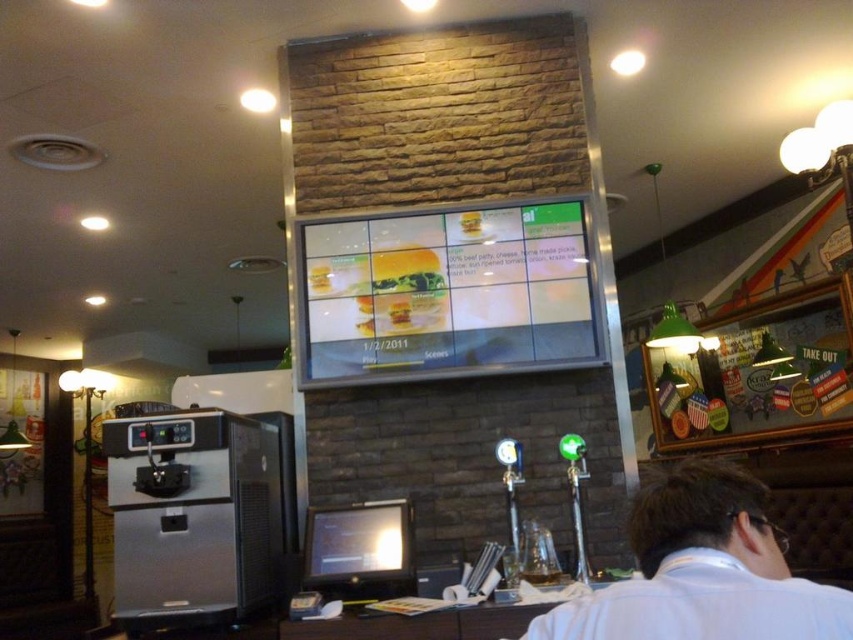
You are a customer entering the restaurant and see the white shirt at lower right and the matte yellow cheeseburger at center. Which object is positioned more to the right side of the scene?

The white shirt at lower right is positioned to the right of the matte yellow cheeseburger at center, so it is more to the right side of the scene.

You are a customer entering the restaurant and see the golden crispy chicken at center and the white shirt at lower right. Which object is positioned to the right of the other?

The white shirt at lower right is positioned to the right of the golden crispy chicken at center.